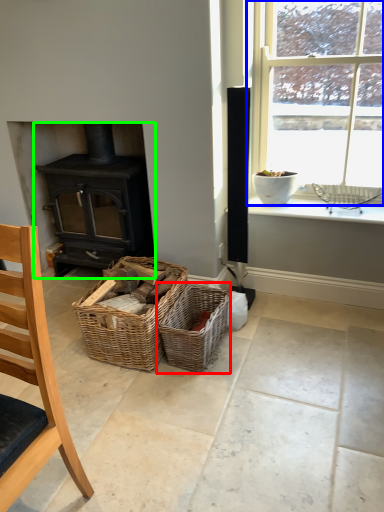
Question: Based on their relative distances, which object is nearer to picnic basket (highlighted by a red box)? Choose from window (highlighted by a blue box) and wood burning stove (highlighted by a green box).

Choices:
 (A) window
 (B) wood burning stove

Answer: (B)